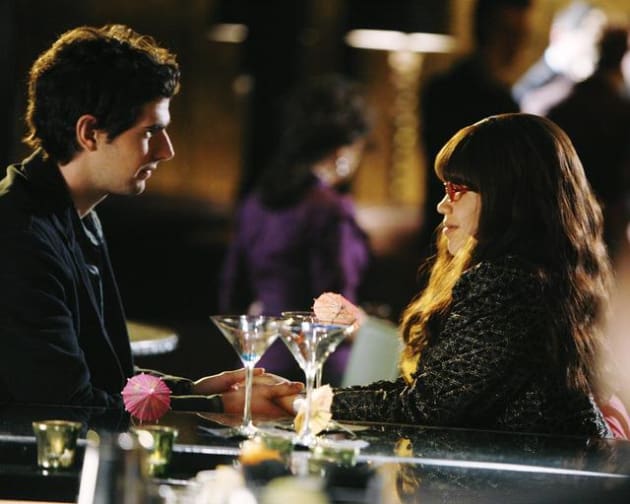
Where is `bar countertop`? Image resolution: width=630 pixels, height=504 pixels. bar countertop is located at coordinates (472, 448).